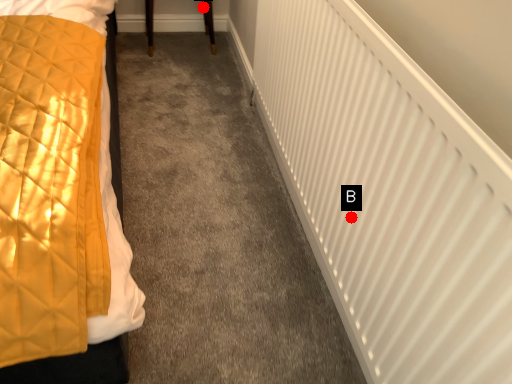
Question: Two points are circled on the image, labeled by A and B beside each circle. Which point is farther to the camera?

Choices:
 (A) A is further
 (B) B is further

Answer: (A)